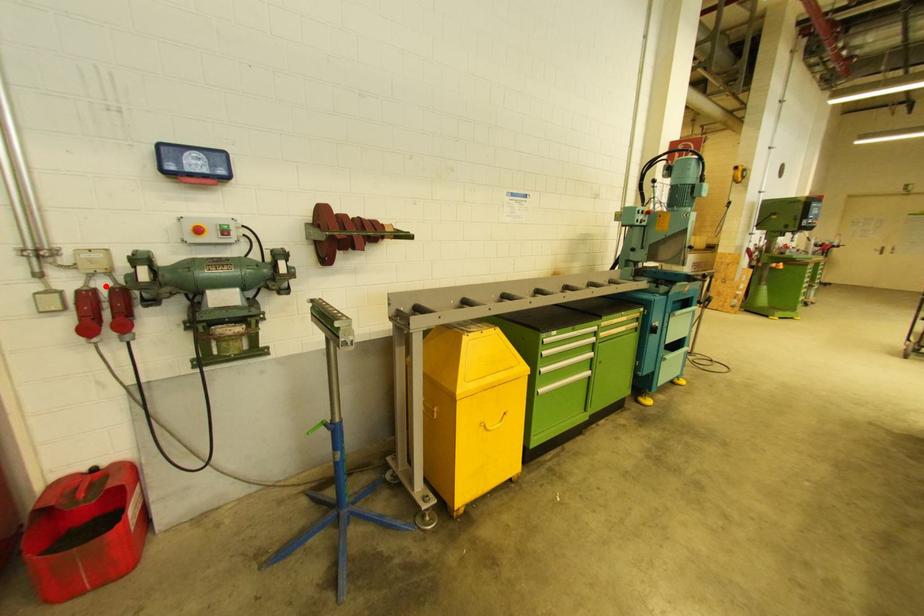
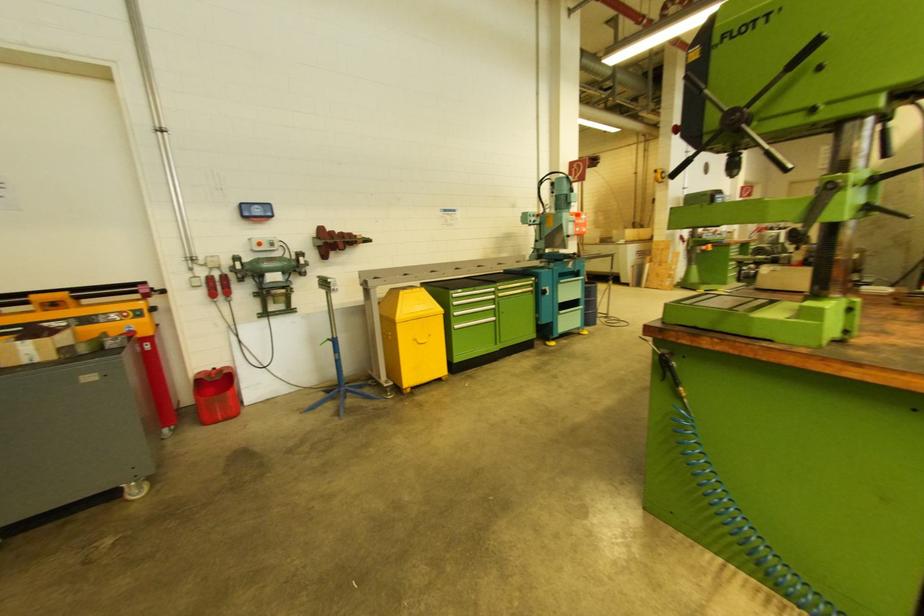
Locate, in the second image, the point that corresponds to the highlighted location in the first image.

(219, 276)